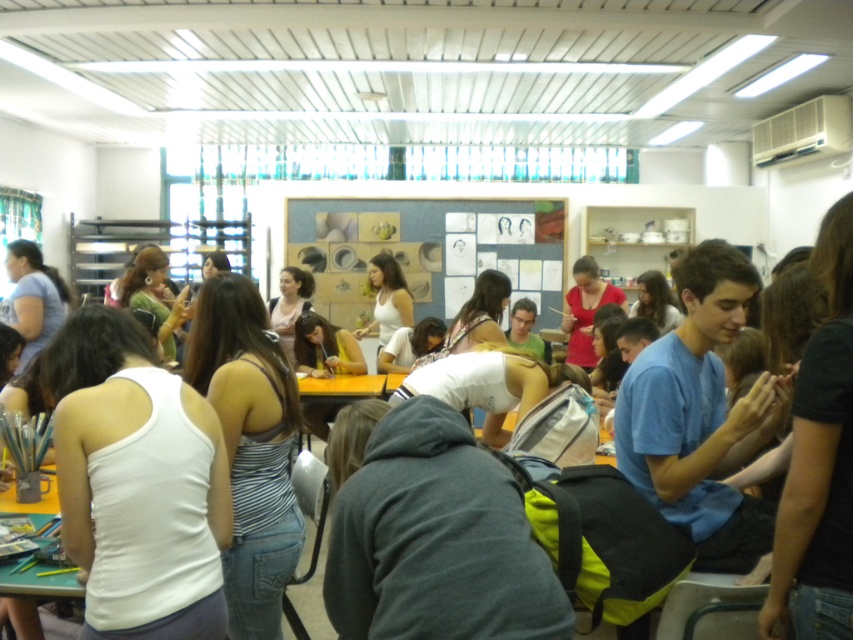
Looking at this image, is white matte tank top at lower left taller than striped fabric tank top at center?

No.

Between point (126, 444) and point (229, 612), which one is positioned behind?

The point (229, 612) is behind.

What do you see at coordinates (137, 483) in the screenshot? I see `white matte tank top at lower left` at bounding box center [137, 483].

Identify the location of white matte tank top at lower left. The height and width of the screenshot is (640, 853). (137, 483).